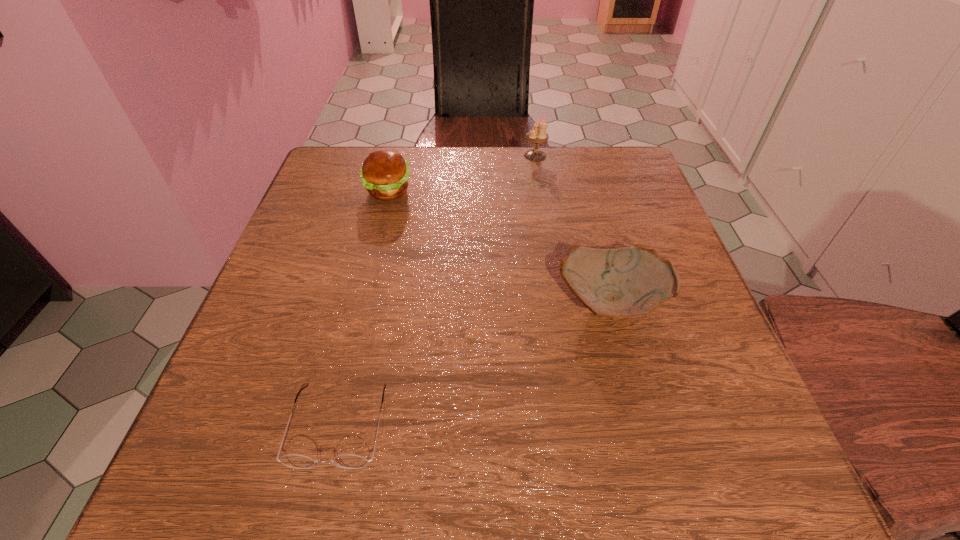
You are a GUI agent. You are given a task and a screenshot of the screen. Output one action in this format:
    pyautogui.click(x=<x>, y=<y>)
    Task: Click on the vacant space at the near edge
    
    Given the screenshot: What is the action you would take?
    pyautogui.click(x=555, y=475)

This screenshot has width=960, height=540. I want to click on free space at the left edge, so click(335, 257).

Find the location of a particular element. This screenshot has width=960, height=540. vacant region at the right edge of the desktop is located at coordinates (687, 354).

Where is `vacant region at the far left corner of the desktop`? Image resolution: width=960 pixels, height=540 pixels. vacant region at the far left corner of the desktop is located at coordinates (348, 179).

In the image, there is a desktop. At what (x,y) coordinates should I click in order to perform the action: click on free region at the far right corner. Please return your answer as a coordinate pair (x, y). Looking at the image, I should click on (607, 158).

In the image, there is a desktop. At what (x,y) coordinates should I click in order to perform the action: click on vacant space at the near right corner. Please return your answer as a coordinate pair (x, y). The width and height of the screenshot is (960, 540). Looking at the image, I should click on (769, 441).

What are the coordinates of `free spot between the nearest object and the farthest object` in the screenshot? It's located at (437, 291).

Find the location of a particular element. vacant area that lies between the third nearest object and the farthest object is located at coordinates (462, 173).

I want to click on free space between the farthest object and the nearest object, so click(437, 291).

In order to click on vacant area that lies between the candle holder and the nearest object in this screenshot , I will do `click(437, 291)`.